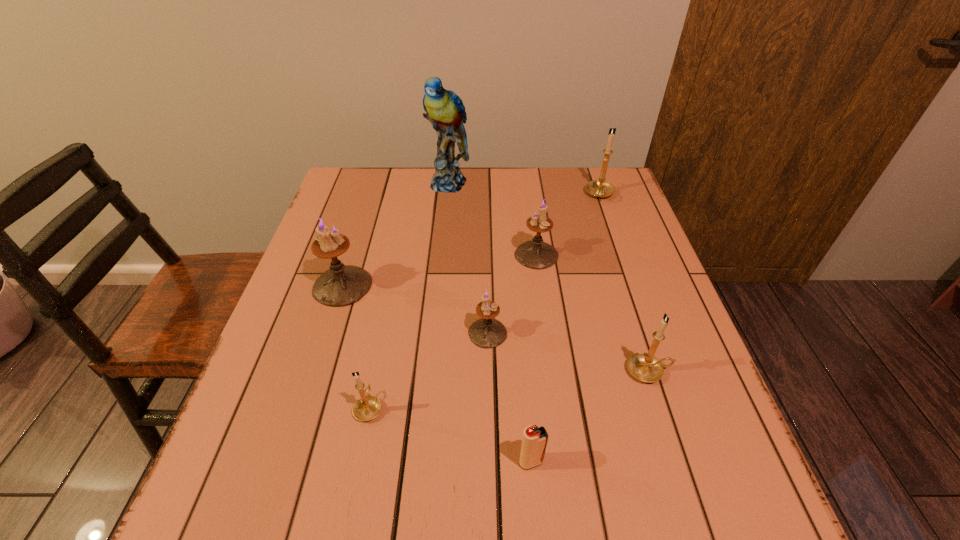
Find the location of a particular element. The image size is (960, 540). free space at the left edge of the desktop is located at coordinates (287, 313).

The height and width of the screenshot is (540, 960). I want to click on free space at the right edge of the desktop, so click(x=593, y=242).

Where is `blank area at the far left corner`? Image resolution: width=960 pixels, height=540 pixels. blank area at the far left corner is located at coordinates (355, 200).

Where is `vacant space at the far right corner`? The image size is (960, 540). vacant space at the far right corner is located at coordinates (572, 168).

The width and height of the screenshot is (960, 540). What are the coordinates of `vacant area between the tallest object and the third nearest candle holder` in the screenshot? It's located at (468, 258).

Identify the location of vacant area between the rightmost purple candle holder and the nearest gold candle holder. Image resolution: width=960 pixels, height=540 pixels. [x=452, y=331].

In order to click on vacant point located between the rightmost purple candle holder and the tallest object in this screenshot , I will do `click(492, 219)`.

Find the location of a particular element. This screenshot has width=960, height=540. free space that is in between the fourth object from left to right and the smallest gold candle holder is located at coordinates (428, 370).

Identify the location of vacant space in between the biggest purple candle holder and the tallest object. The image size is (960, 540). (396, 234).

In order to click on empty location between the third nearest object and the nearest candle holder in this screenshot , I will do pyautogui.click(x=509, y=389).